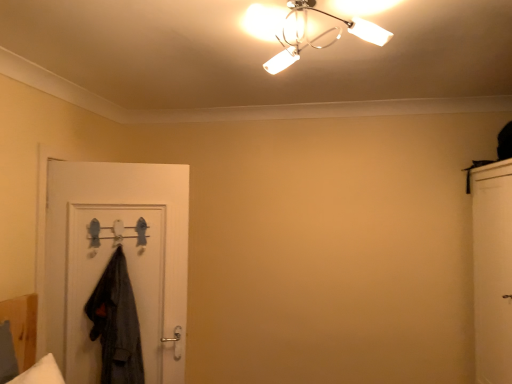
Find the location of `metallic chrome chandelier at upper center`. metallic chrome chandelier at upper center is located at coordinates (317, 35).

The image size is (512, 384). Describe the element at coordinates (317, 35) in the screenshot. I see `metallic chrome chandelier at upper center` at that location.

Find the location of a particular element. Image resolution: width=512 pixels, height=384 pixels. metallic chrome chandelier at upper center is located at coordinates (317, 35).